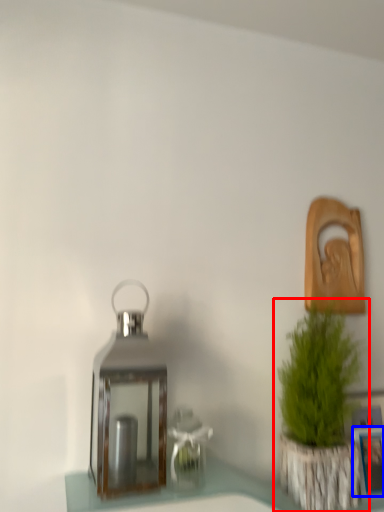
Question: Which object is further to the camera taking this photo, houseplant (highlighted by a red box) or picture frame (highlighted by a blue box)?

Choices:
 (A) houseplant
 (B) picture frame

Answer: (B)